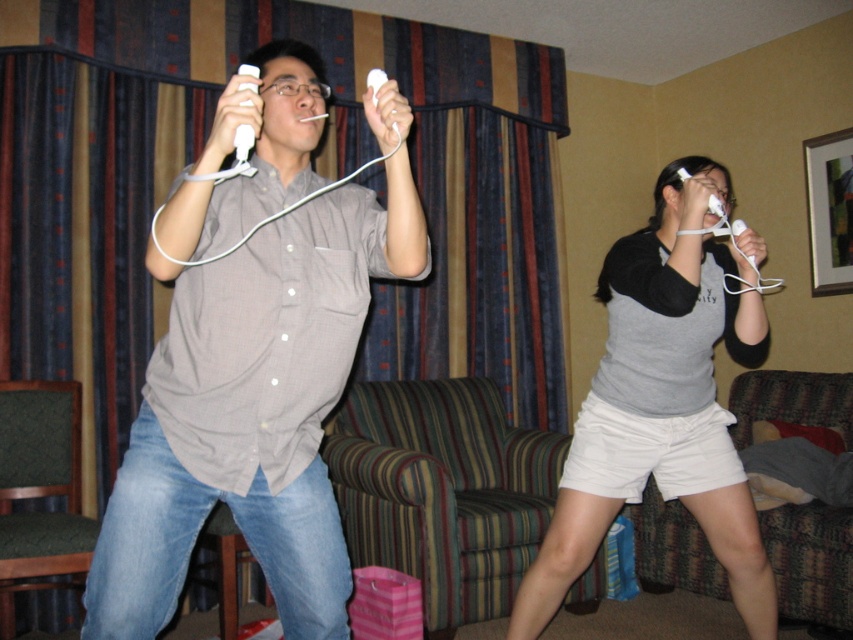
Question: Is matte gray shirt at center thinner than white matte remote at upper center?

Choices:
 (A) no
 (B) yes

Answer: (A)

Question: Which of the following is the farthest from the observer?

Choices:
 (A) matte gray shirt at center
 (B) gray cotton shirt at center
 (C) white matte remote at upper center

Answer: (B)

Question: Is matte gray shirt at center smaller than white matte remote at upper center?

Choices:
 (A) yes
 (B) no

Answer: (B)

Question: Estimate the real-world distances between objects in this image. Which object is closer to the matte gray shirt at center?

Choices:
 (A) gray cotton shirt at center
 (B) white matte remote at upper center

Answer: (B)

Question: Which point is closer to the camera?

Choices:
 (A) gray cotton shirt at center
 (B) white matte remote at upper center
 (C) matte gray shirt at center

Answer: (B)

Question: Does gray cotton shirt at center appear over white matte remote at upper center?

Choices:
 (A) yes
 (B) no

Answer: (B)